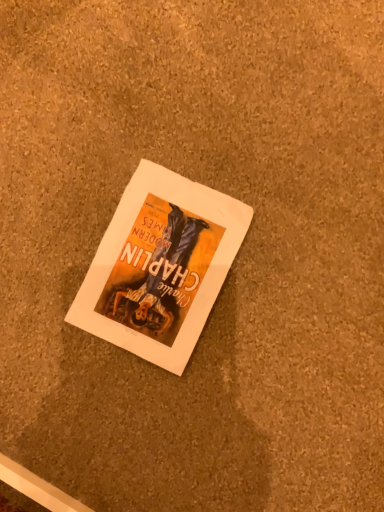
Locate an element on the screen. vacant position to the left of matte paper book at center is located at coordinates (47, 296).